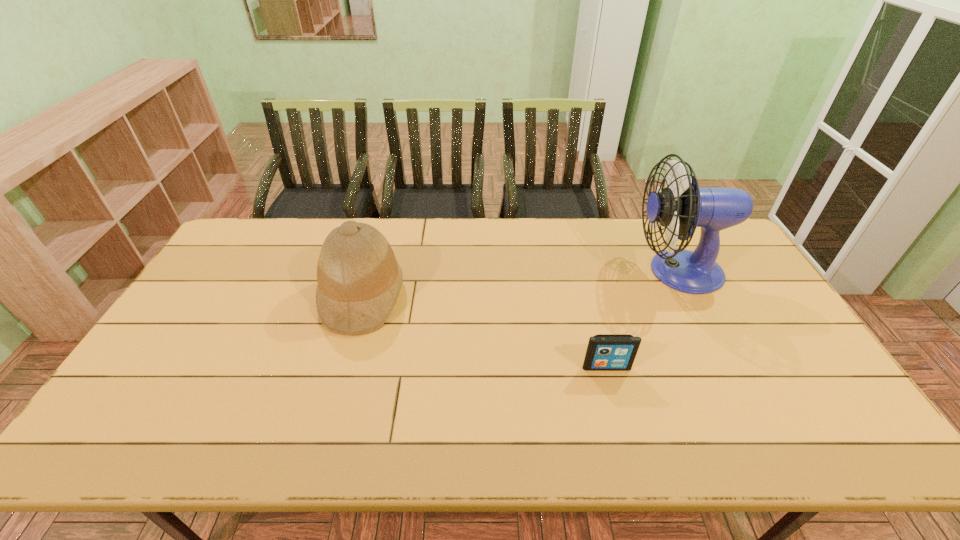
This screenshot has width=960, height=540. In order to click on object identified as the second closest to the fan in this screenshot , I will do `click(359, 279)`.

You are a GUI agent. You are given a task and a screenshot of the screen. Output one action in this format:
    pyautogui.click(x=<x>, y=<y>)
    Task: Click on the blank area in the image that satisfies the following two spatial constraints: 1. in front of the tallest object where the airflow is directed; 2. on the front screen of the shortest object
    
    Given the screenshot: What is the action you would take?
    pyautogui.click(x=726, y=367)

In order to click on vacant position in the image that satisfies the following two spatial constraints: 1. in front of the fan where the airflow is directed; 2. on the front screen of the nearest object in this screenshot , I will do 726,367.

The width and height of the screenshot is (960, 540). In order to click on vacant space that satisfies the following two spatial constraints: 1. in front of the tallest object where the airflow is directed; 2. on the front screen of the second object from left to right in this screenshot , I will do (x=726, y=367).

I want to click on vacant point that satisfies the following two spatial constraints: 1. in front of the tallest object where the airflow is directed; 2. on the front screen of the nearest object, so click(x=726, y=367).